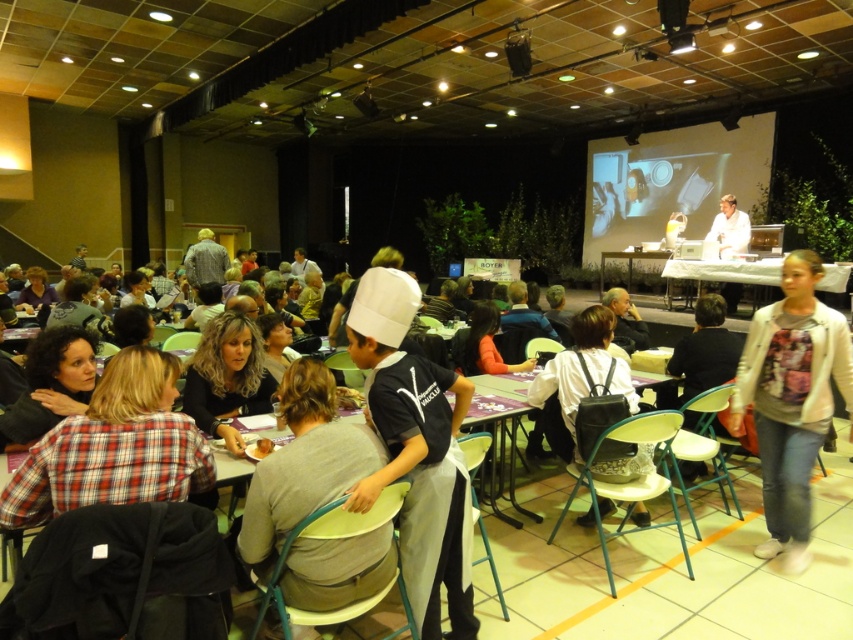
You are attending a culinary workshop and notice a chef in the room. Where is the gray fabric shirt at center relative to the attendees seated at the round tables with purple tablecloths?

The gray fabric shirt at center is located at point (303,464), which places it near the front of the scene, closer to the attendees at the round tables with purple tablecloths.

You are a photographer standing at the back of the hall. You want to take a photo that includes both the gray fabric shirt at center and the white fabric shirt at center. Given that your camera has a maximum focus range of 8 meters, will both subjects be in focus?

The distance between the gray fabric shirt at center and the white fabric shirt at center is 7.78 meters, which is within the camera maximum focus range of 8 meters. Therefore, both subjects will be in focus.

You are a photographer taking a group photo of the attendees at the event. You notice the gray fabric shirt at center and curly hair at lower left. Which of these two features should you adjust your camera focus on first to ensure both are in frame, considering their sizes?

The gray fabric shirt at center is wider than curly hair at lower left, so you should focus on the gray fabric shirt at center first to accommodate its larger size within the frame.